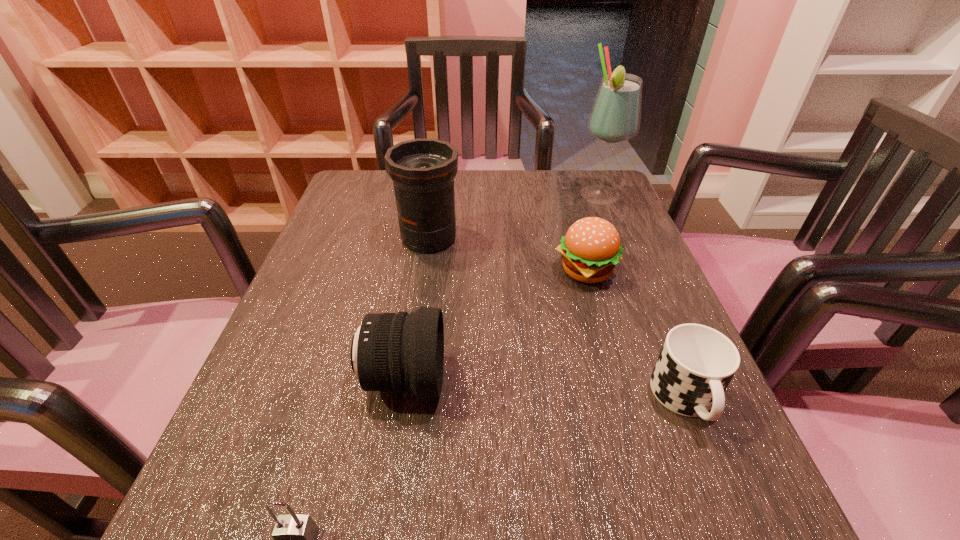
Find the location of a particular element. The height and width of the screenshot is (540, 960). free location located on the front of the hamburger is located at coordinates (600, 322).

You are a GUI agent. You are given a task and a screenshot of the screen. Output one action in this format:
    pyautogui.click(x=<x>, y=<y>)
    Task: Click on the object located in the far edge section of the desktop
    
    Given the screenshot: What is the action you would take?
    pyautogui.click(x=615, y=117)

Locate an element on the screen. This screenshot has height=540, width=960. alcohol at the right edge is located at coordinates (615, 117).

What are the coordinates of `hamburger situated at the right edge` in the screenshot? It's located at (590, 250).

The height and width of the screenshot is (540, 960). In order to click on cup located at the right edge in this screenshot , I will do tap(696, 364).

Where is `object that is at the far right corner`? The height and width of the screenshot is (540, 960). object that is at the far right corner is located at coordinates (615, 117).

This screenshot has height=540, width=960. In order to click on free space at the far edge in this screenshot , I will do [x=540, y=198].

Find the location of `free space at the left edge of the desktop`. free space at the left edge of the desktop is located at coordinates (283, 321).

At what (x,y) coordinates should I click in order to perform the action: click on free space at the far left corner of the desktop. Please return your answer as a coordinate pair (x, y). This screenshot has width=960, height=540. Looking at the image, I should click on (351, 212).

Find the location of a particular element. vacant space at the far right corner of the desktop is located at coordinates (600, 181).